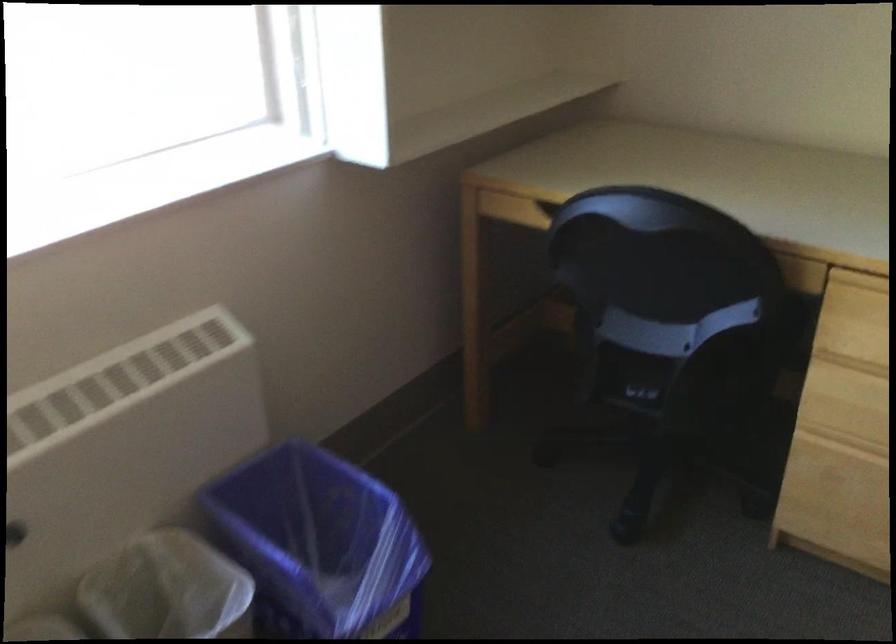
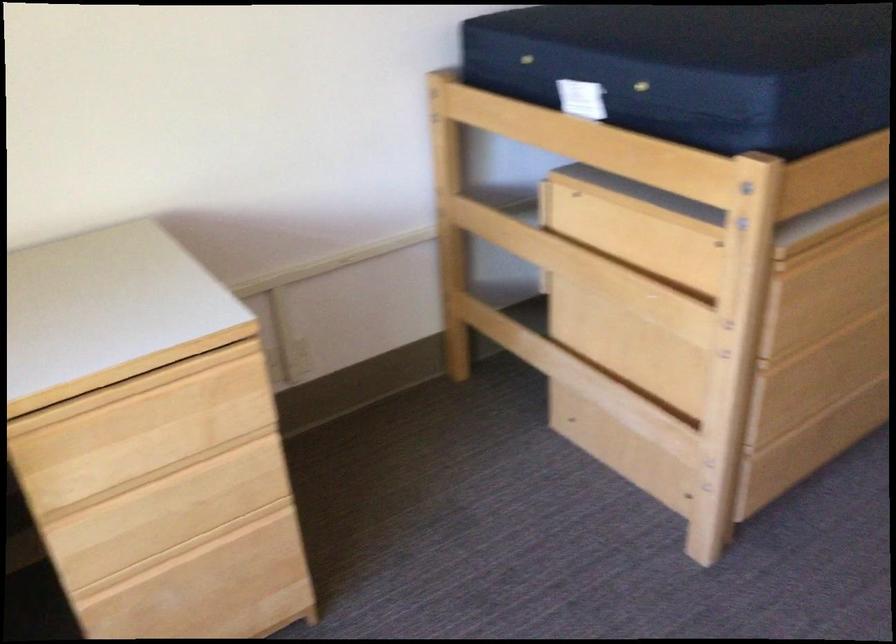
Question: Based on the continuous images, in which direction is the camera rotating? Reply with the corresponding letter.

Choices:
 (A) Left
 (B) Right
 (C) Up
 (D) Down

Answer: (B)